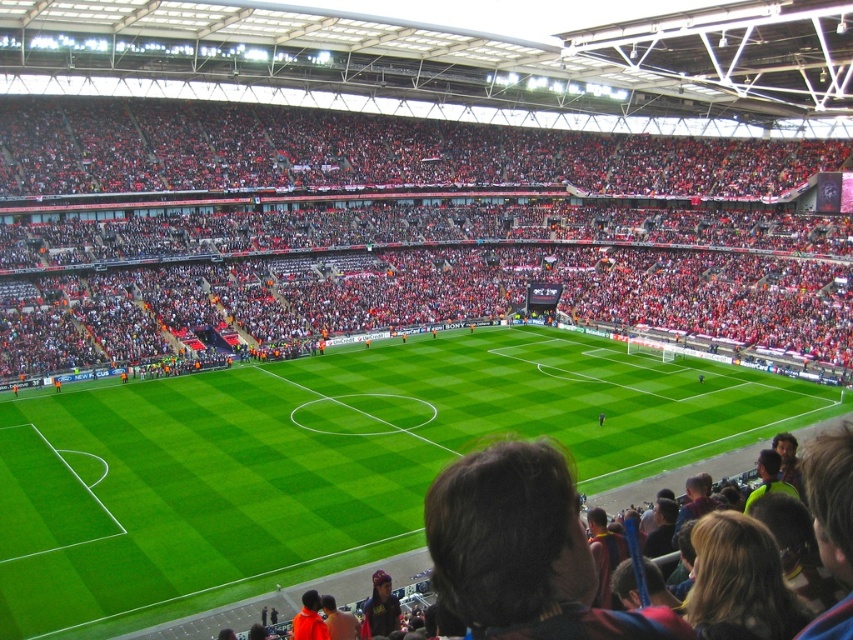
You are a spectator sitting in the red fabric seats at center. You want to watch the football match happening on the green grass football field at center. Which direction should you look to see the field?

The green grass football field at center is behind the red fabric seats at center, so you should look behind you to see the field.

You are a photographer standing at the camera position. You want to capture a closeup of the red fabric seats at center. Given that your camera has a maximum zoom range of 50 meters, will you be able to get a clear closeup shot?

The red fabric seats at center and camera are 62.38 meters apart. Since the maximum zoom range of your camera is 50 meters, you will not be able to get a clear closeup shot of the red fabric seats at center.

You are a drone operator trying to capture aerial footage of the stadium. You notice the red fabric seats at center and the green grass football field at center. Which object is located above the other?

The red fabric seats at center are positioned over the green grass football field at center, so the seats are above the field.